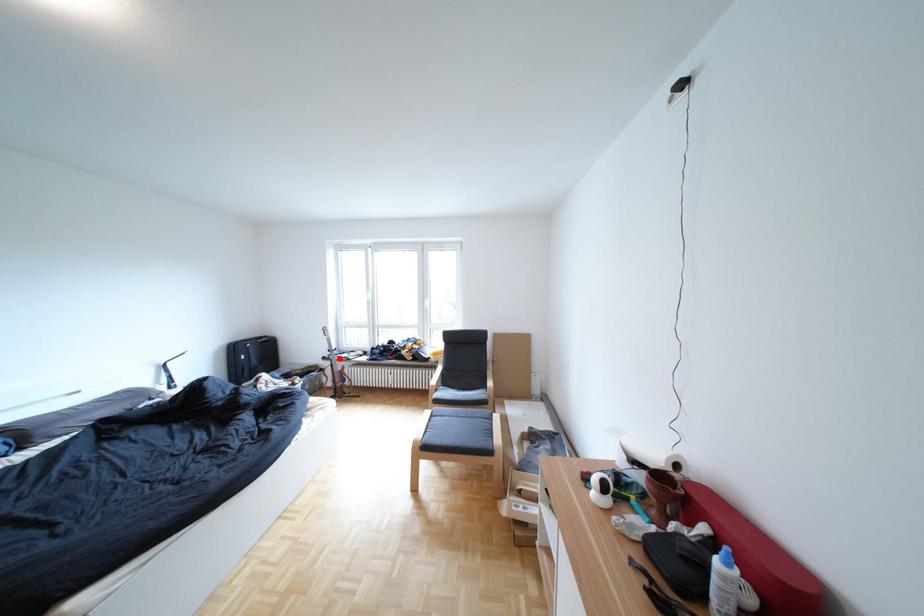
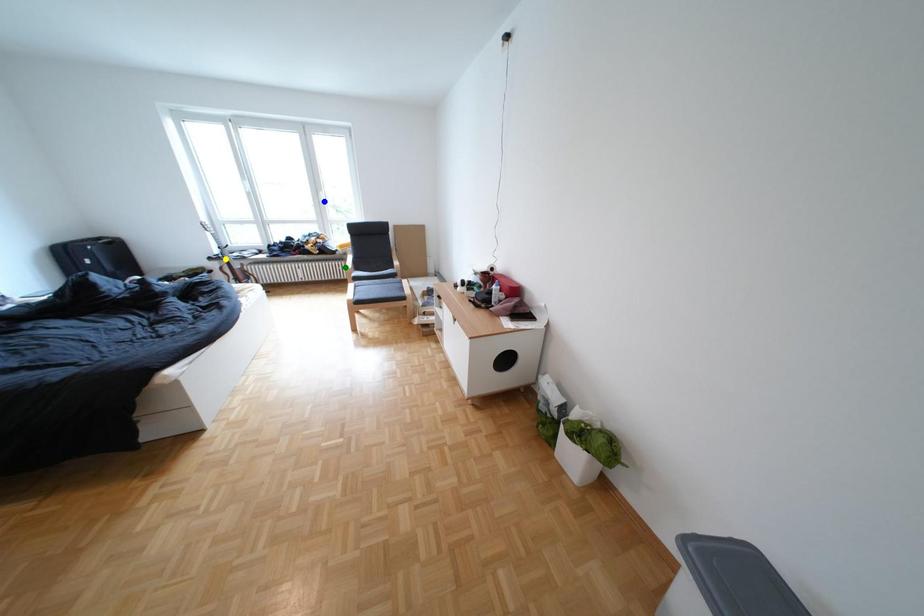
Question: I am providing you with two images of the same scene from different viewpoints. A red point is marked on the first image. You are given multiple points on the second image. In image 2, which mark is for the same physical point as the one in image 1?

Choices:
 (A) yellow point
 (B) blue point
 (C) green point

Answer: (A)